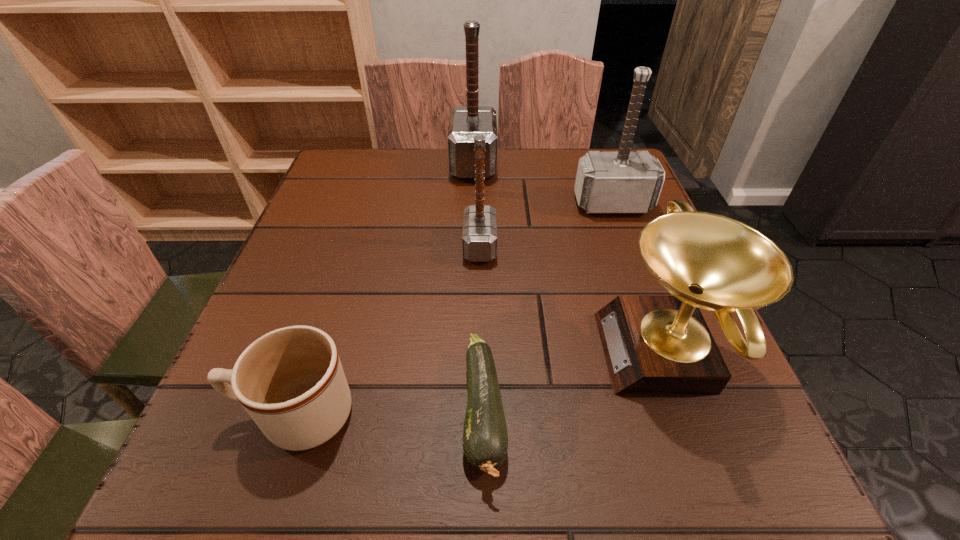
Image resolution: width=960 pixels, height=540 pixels. I want to click on object present at the near left corner, so click(x=290, y=381).

Locate an element on the screen. The height and width of the screenshot is (540, 960). object that is at the far right corner is located at coordinates (623, 182).

Where is `vacant area at the far edge of the desktop`? The image size is (960, 540). vacant area at the far edge of the desktop is located at coordinates (566, 183).

In the image, there is a desktop. At what (x,y) coordinates should I click in order to perform the action: click on vacant area at the near edge. Please return your answer as a coordinate pair (x, y). This screenshot has height=540, width=960. Looking at the image, I should click on [x=356, y=468].

Find the location of a particular element. blank space at the left edge is located at coordinates (353, 293).

Identify the location of free space at the right edge of the desktop. The width and height of the screenshot is (960, 540). (644, 218).

The width and height of the screenshot is (960, 540). What are the coordinates of `free space at the far left corner of the desktop` in the screenshot? It's located at (321, 196).

Identify the location of vacant space that's between the zucchini and the second farthest object. The height and width of the screenshot is (540, 960). 548,308.

Identify the location of free area in between the leftmost object and the nearest hammer. (388, 330).

You are a GUI agent. You are given a task and a screenshot of the screen. Output one action in this format:
    pyautogui.click(x=<x>, y=<y>)
    Task: Click on the free space between the farthest hammer and the leftmost object
    This screenshot has width=960, height=540.
    Given the screenshot: What is the action you would take?
    pyautogui.click(x=385, y=289)